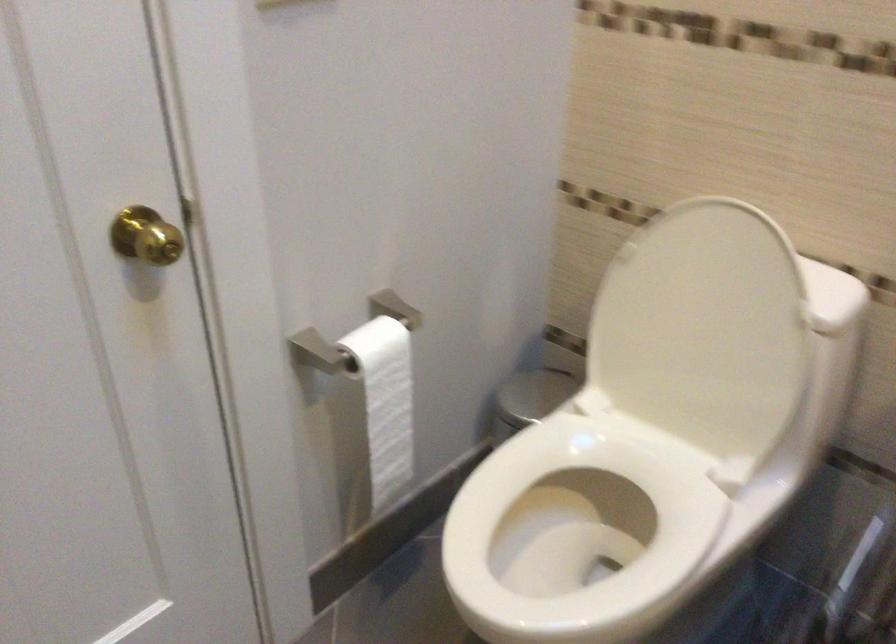
Where is `trash can lid`? This screenshot has height=644, width=896. trash can lid is located at coordinates (532, 395).